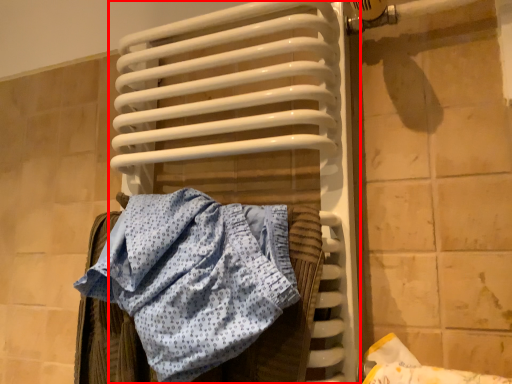
Question: In this image, where is radiator (annotated by the red box) located relative to towel?

Choices:
 (A) right
 (B) left

Answer: (A)